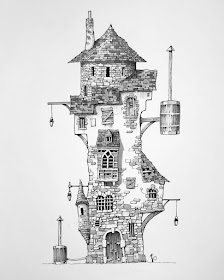
This screenshot has width=224, height=280. What are the coordinates of `window` in the screenshot? It's located at (99, 200).